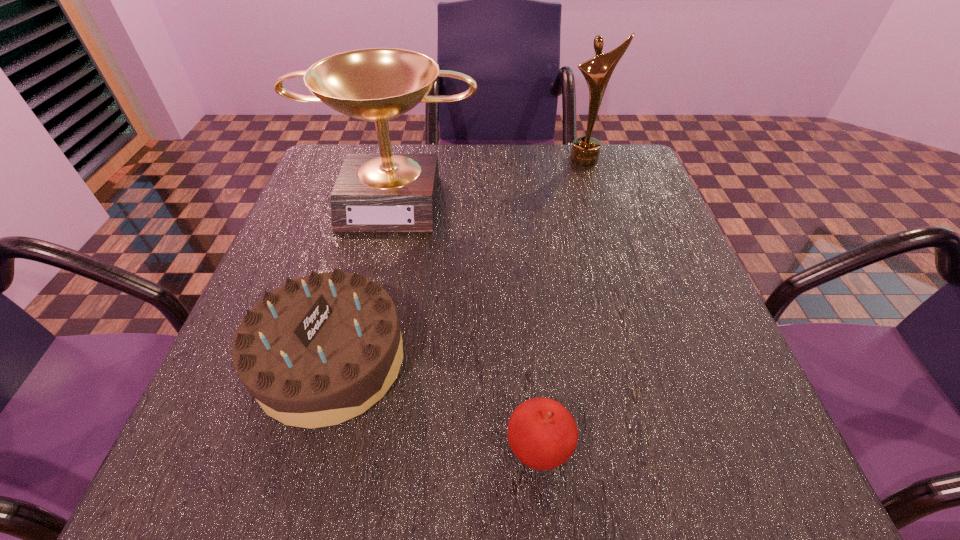
Where is `vacant point at the right edge`? vacant point at the right edge is located at coordinates (675, 394).

The image size is (960, 540). In the image, there is a desktop. Identify the location of vacant space at the far left corner. (332, 181).

In the image, there is a desktop. Where is `free space at the far right corner`? free space at the far right corner is located at coordinates (595, 167).

This screenshot has width=960, height=540. I want to click on free space between the second shortest object and the right award, so click(x=458, y=259).

Where is `free spot between the birthday cake and the rightmost object`? Image resolution: width=960 pixels, height=540 pixels. free spot between the birthday cake and the rightmost object is located at coordinates (458, 259).

This screenshot has width=960, height=540. Identify the location of vacant area that lies between the apple and the left award. pyautogui.click(x=466, y=322).

At what (x,y) coordinates should I click in order to perform the action: click on free space between the birthday cake and the right award. Please return your answer as a coordinate pair (x, y). Looking at the image, I should click on click(x=458, y=259).

Image resolution: width=960 pixels, height=540 pixels. In order to click on vacant area between the rightmost object and the third tallest object in this screenshot , I will do `click(458, 259)`.

The image size is (960, 540). I want to click on unoccupied area between the third tallest object and the right award, so click(x=458, y=259).

The image size is (960, 540). I want to click on free space between the right award and the shortest object, so click(x=562, y=304).